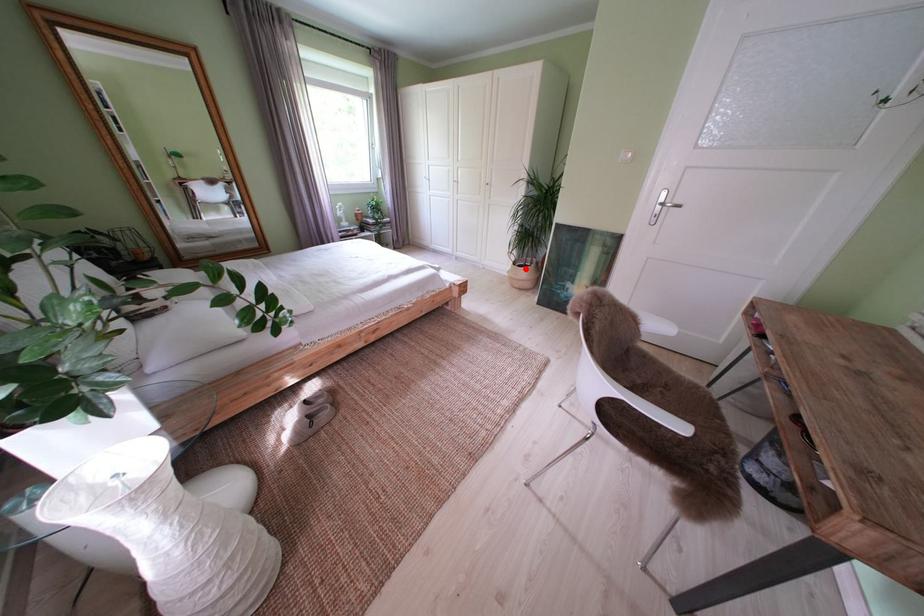
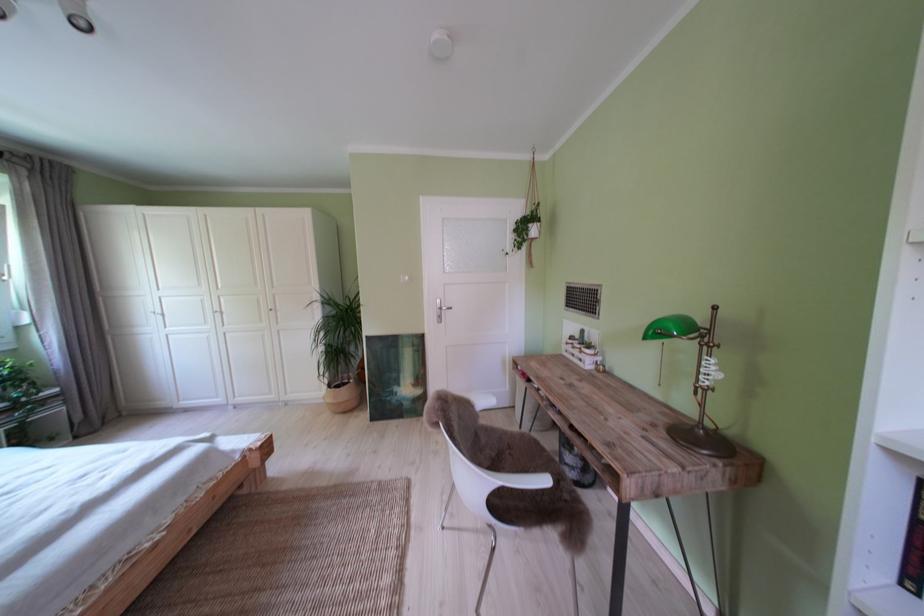
Find the pixel in the second image that matches the highlighted location in the first image.

(341, 392)